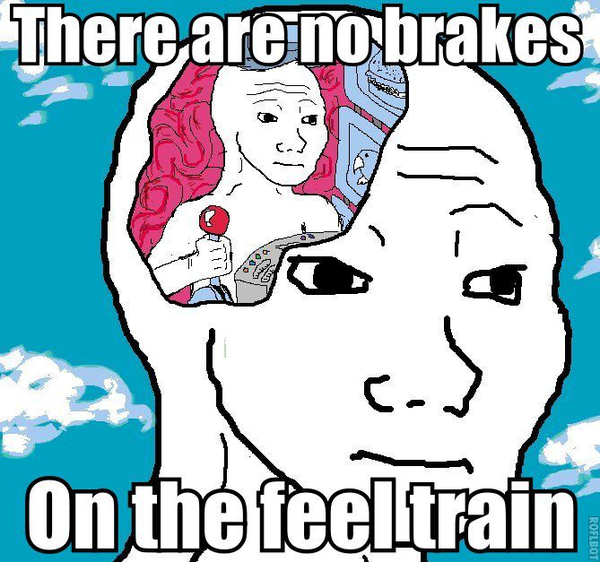
This screenshot has height=562, width=600. What are the coordinates of `pictures` in the screenshot? It's located at (377, 81), (364, 144), (344, 214).